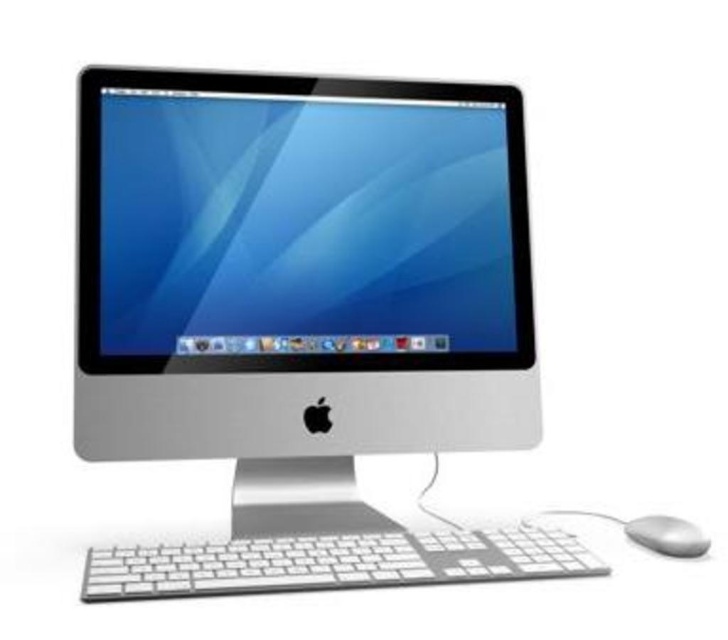
Can you confirm if white plastic keyboard at lower center is taller than satin silver mouse at lower right?

Indeed, white plastic keyboard at lower center has a greater height compared to satin silver mouse at lower right.

Is white plastic keyboard at lower center to the left of satin silver mouse at lower right from the viewer's perspective?

Indeed, white plastic keyboard at lower center is positioned on the left side of satin silver mouse at lower right.

Where is `white plastic keyboard at lower center`? white plastic keyboard at lower center is located at coordinates (333, 563).

Looking at this image, does sleek silver monitor at center have a larger size compared to satin silver mouse at lower right?

Indeed, sleek silver monitor at center has a larger size compared to satin silver mouse at lower right.

Which is behind, point (158, 394) or point (641, 531)?

The point (158, 394) is behind.

Is point (375, 356) positioned before point (680, 538)?

No, it is not.

Where is `sleek silver monitor at center`? sleek silver monitor at center is located at coordinates (300, 264).

Which of these two, sleek silver monitor at center or white plastic keyboard at lower center, stands taller?

Standing taller between the two is sleek silver monitor at center.

Can you confirm if sleek silver monitor at center is positioned to the left of white plastic keyboard at lower center?

Correct, you'll find sleek silver monitor at center to the left of white plastic keyboard at lower center.

Image resolution: width=728 pixels, height=640 pixels. What are the coordinates of `sleek silver monitor at center` in the screenshot? It's located at (300, 264).

Locate an element on the screen. The image size is (728, 640). sleek silver monitor at center is located at coordinates (300, 264).